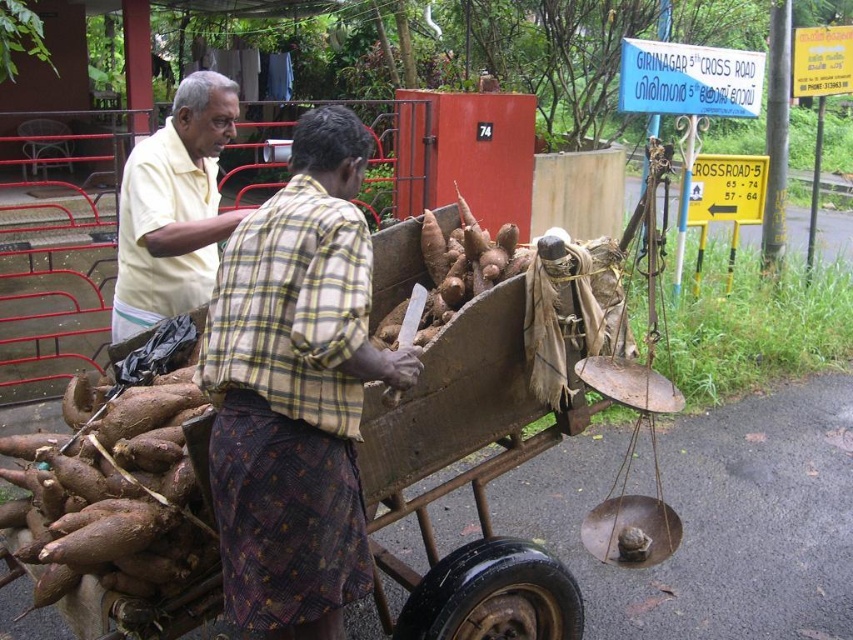
Is point (335, 342) positioned in front of point (225, 106)?

Yes, it is.

Can you confirm if yellow cotton shirt at center is positioned above yellow cotton shirt at upper left?

Actually, yellow cotton shirt at center is below yellow cotton shirt at upper left.

Is point (317, 212) positioned before point (202, 147)?

Yes, it is.

Identify the location of yellow cotton shirt at center. (x=294, y=392).

The width and height of the screenshot is (853, 640). What do you see at coordinates (494, 438) in the screenshot?
I see `brown wooden cart at center` at bounding box center [494, 438].

Where is `brown wooden cart at center`? brown wooden cart at center is located at coordinates (494, 438).

Does point (432, 497) come farther from viewer compared to point (312, 369)?

Yes, it is.

Locate an element on the screen. The image size is (853, 640). brown wooden cart at center is located at coordinates (494, 438).

Does brown wooden cart at center have a greater width compared to yellow cotton shirt at upper left?

Correct, the width of brown wooden cart at center exceeds that of yellow cotton shirt at upper left.

Is point (413, 276) positioned after point (140, 324)?

That is True.

You are a GUI agent. You are given a task and a screenshot of the screen. Output one action in this format:
    pyautogui.click(x=<x>, y=<y>)
    Task: Click on the brown wooden cart at center
    This screenshot has height=640, width=853.
    Given the screenshot: What is the action you would take?
    coord(494,438)